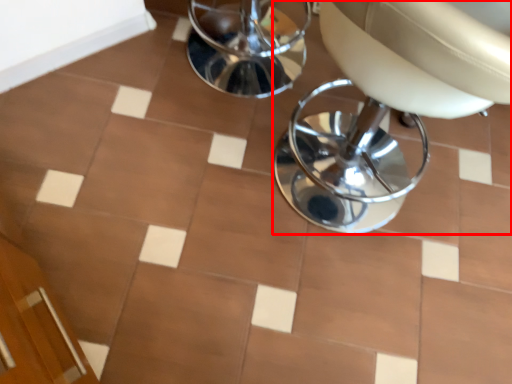
Question: From the image, what is the correct spatial relationship of chair (annotated by the red box) in relation to ceramic tile?

Choices:
 (A) left
 (B) right

Answer: (B)